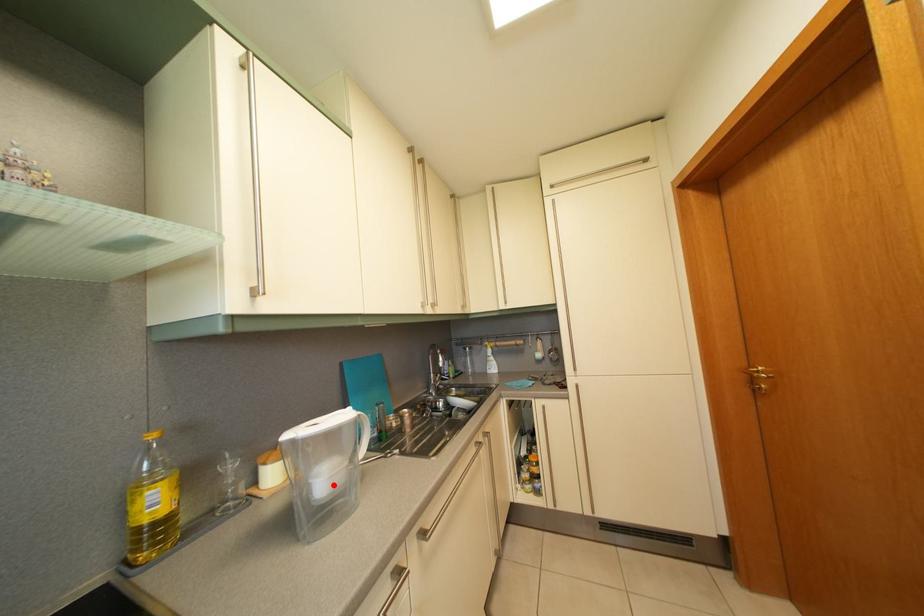
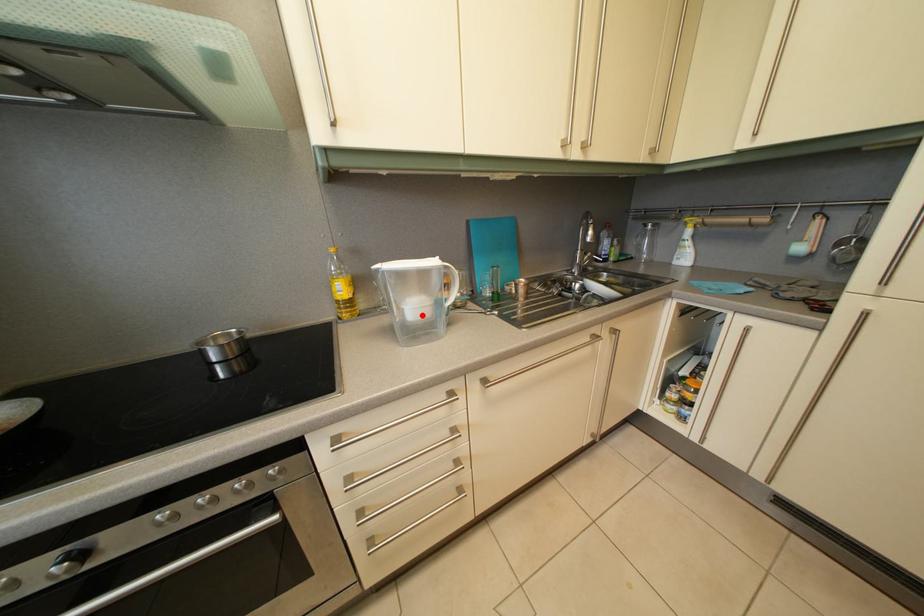
I am providing you with two images of the same scene from different viewpoints. A red point is marked on the first image and another point is marked on the second image. Do the highlighted points in image1 and image2 indicate the same real-world spot?

Yes